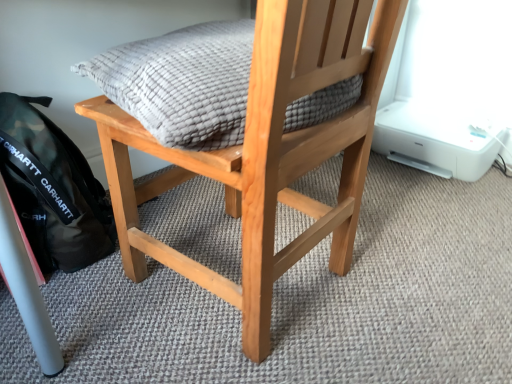
Question: Considering the positions of black matte backpack at lower left and natural wood chair at center in the image, is black matte backpack at lower left taller or shorter than natural wood chair at center?

Choices:
 (A) tall
 (B) short

Answer: (B)

Question: From the image's perspective, is black matte backpack at lower left above or below natural wood chair at center?

Choices:
 (A) below
 (B) above

Answer: (A)

Question: Which object is the closest to the textured gray cushion at center?

Choices:
 (A) natural wood chair at center
 (B) black matte backpack at lower left

Answer: (A)

Question: Considering the real-world distances, which object is farthest from the textured gray cushion at center?

Choices:
 (A) black matte backpack at lower left
 (B) natural wood chair at center

Answer: (A)